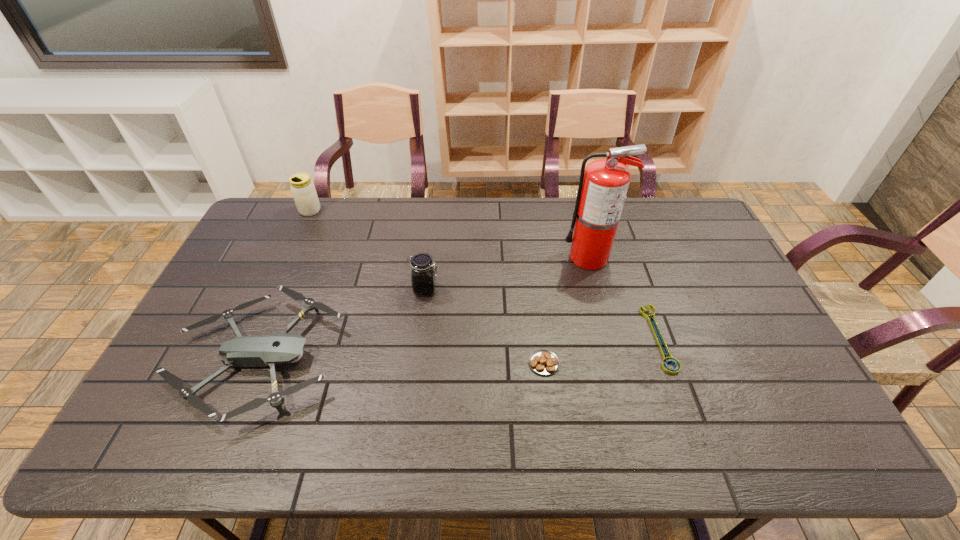
The width and height of the screenshot is (960, 540). I want to click on the tallest object, so click(x=603, y=185).

At what (x,y) coordinates should I click in order to perform the action: click on fire extinguisher. Please return your answer as a coordinate pair (x, y). The width and height of the screenshot is (960, 540). Looking at the image, I should click on (603, 185).

Image resolution: width=960 pixels, height=540 pixels. What are the coordinates of `the left jar` in the screenshot? It's located at [x=303, y=190].

Identify the location of the farther jar. (303, 190).

You are a GUI agent. You are given a task and a screenshot of the screen. Output one action in this format:
    pyautogui.click(x=<x>, y=<y>)
    Task: Click on the right jar
    Image resolution: width=960 pixels, height=540 pixels.
    Given the screenshot: What is the action you would take?
    pyautogui.click(x=423, y=276)

You are a GUI agent. You are given a task and a screenshot of the screen. Output one action in this format:
    pyautogui.click(x=<x>, y=<y>)
    Task: Click on the fourth object from right to left
    The height and width of the screenshot is (540, 960).
    Given the screenshot: What is the action you would take?
    pyautogui.click(x=423, y=276)

Locate an element on the screen. The width and height of the screenshot is (960, 540). drone is located at coordinates [268, 350].

Locate an element on the screen. The image size is (960, 540). pastry is located at coordinates (544, 362).

In order to click on the third object from right to left in this screenshot , I will do `click(544, 362)`.

At what (x,y) coordinates should I click in order to perform the action: click on the rightmost object. Please return your answer as a coordinate pair (x, y). Looking at the image, I should click on (670, 359).